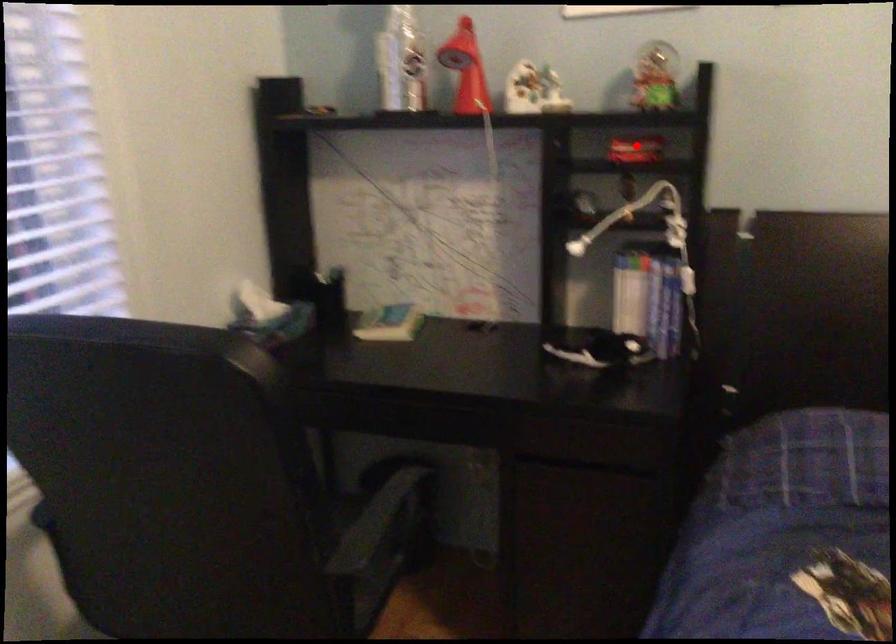
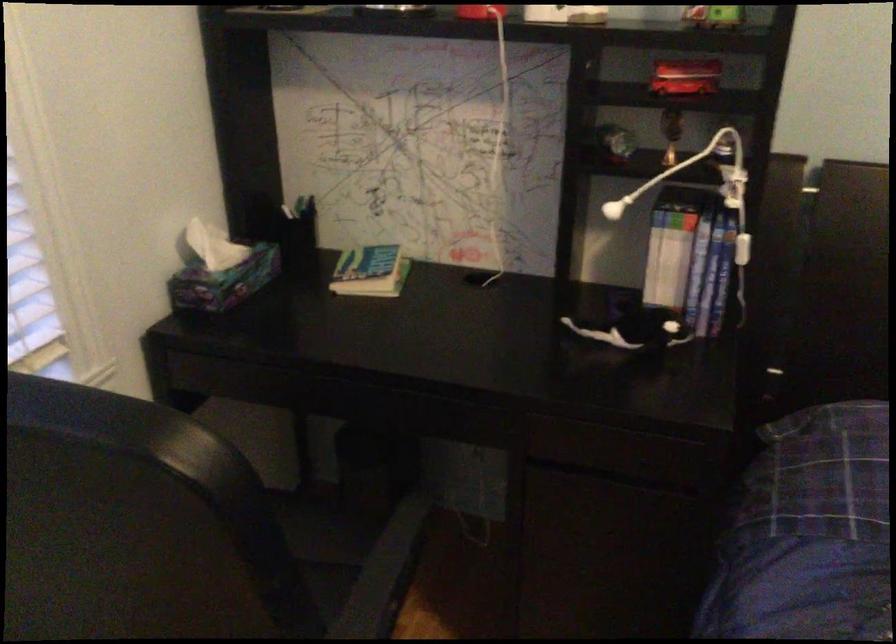
The point at the highlighted location is marked in the first image. Where is the corresponding point in the second image?

(685, 77)